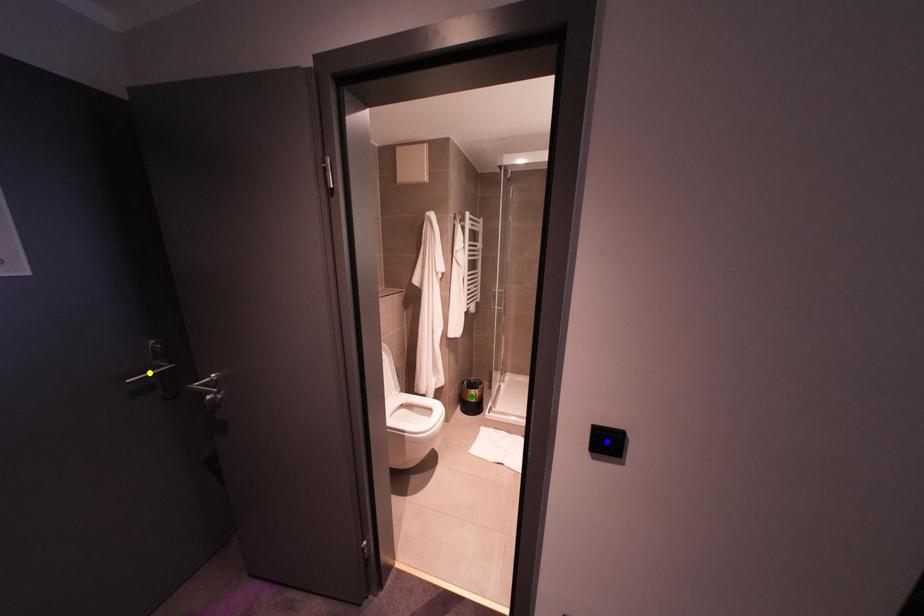
Order these from nearest to farthest:
- blue point
- yellow point
- green point

blue point → yellow point → green point